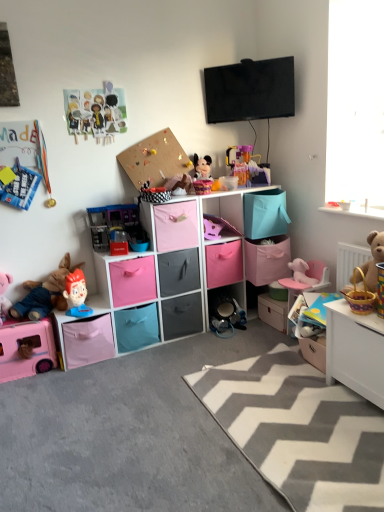
Question: Is matte paper dolls at upper left, which appears as the fourth toy when viewed from the left, shorter than pink fabric cabinet at center, the 3th cabinet ordered from the bottom?

Choices:
 (A) no
 (B) yes

Answer: (A)

Question: Can you confirm if matte paper dolls at upper left, which appears as the fourth toy when viewed from the left, is taller than pink fabric cabinet at center, the 3th cabinet ordered from the bottom?

Choices:
 (A) yes
 (B) no

Answer: (A)

Question: From the image's perspective, does matte paper dolls at upper left, which appears as the fourth toy when viewed from the left, appear higher than pink fabric cabinet at center, the first cabinet positioned from the top?

Choices:
 (A) no
 (B) yes

Answer: (B)

Question: From a real-world perspective, is matte paper dolls at upper left, the 7th toy from the right, on top of pink fabric cabinet at center, the first cabinet positioned from the top?

Choices:
 (A) no
 (B) yes

Answer: (B)

Question: Can you confirm if matte paper dolls at upper left, which appears as the fourth toy when viewed from the left, is positioned to the left of pink fabric cabinet at center, the 3th cabinet ordered from the bottom?

Choices:
 (A) yes
 (B) no

Answer: (A)

Question: From their relative heights in the image, would you say plush fabric toy at left, which is the 9th toy in right-to-left order, is taller or shorter than pink fabric plush at center, the 4th toy in the right-to-left sequence?

Choices:
 (A) tall
 (B) short

Answer: (A)

Question: Considering the positions of plush fabric toy at left, which is the 9th toy in right-to-left order, and pink fabric plush at center, the 4th toy in the right-to-left sequence, in the image, is plush fabric toy at left, which is the 9th toy in right-to-left order, bigger or smaller than pink fabric plush at center, the 4th toy in the right-to-left sequence,?

Choices:
 (A) big
 (B) small

Answer: (A)

Question: Is plush fabric toy at left, which is the 9th toy in right-to-left order, in front of or behind pink fabric plush at center, positioned as the 7th toy in left-to-right order, in the image?

Choices:
 (A) front
 (B) behind

Answer: (A)

Question: Is plush fabric toy at left, acting as the 2th toy starting from the left, to the left or to the right of pink fabric plush at center, positioned as the 7th toy in left-to-right order, in the image?

Choices:
 (A) right
 (B) left

Answer: (B)

Question: Would you say pink fabric cardboard box at lower left is inside or outside plastic play kitchen at center, which is the 5th toy from left to right?

Choices:
 (A) outside
 (B) inside

Answer: (A)

Question: In the image, is pink fabric cardboard box at lower left positioned in front of or behind plastic play kitchen at center, which appears as the 6th toy when viewed from the right?

Choices:
 (A) behind
 (B) front

Answer: (B)

Question: Considering the positions of pink fabric cardboard box at lower left and plastic play kitchen at center, which is the 5th toy from left to right, in the image, is pink fabric cardboard box at lower left bigger or smaller than plastic play kitchen at center, which is the 5th toy from left to right,?

Choices:
 (A) big
 (B) small

Answer: (A)

Question: Is pink fabric cardboard box at lower left wider or thinner than plastic play kitchen at center, which is the 5th toy from left to right?

Choices:
 (A) thin
 (B) wide

Answer: (B)

Question: Is white glossy table at lower right bigger or smaller than plastic toy at left, the eighth toy when ordered from right to left?

Choices:
 (A) small
 (B) big

Answer: (B)

Question: In the image, is white glossy table at lower right positioned in front of or behind plastic toy at left, the eighth toy when ordered from right to left?

Choices:
 (A) behind
 (B) front

Answer: (B)